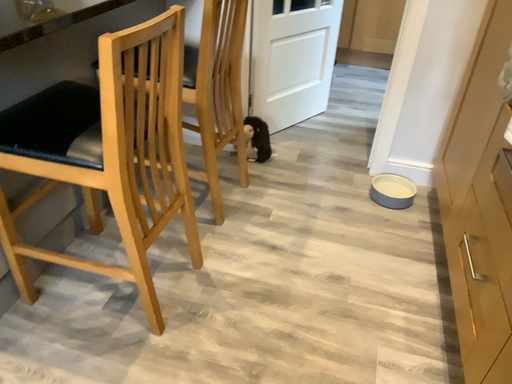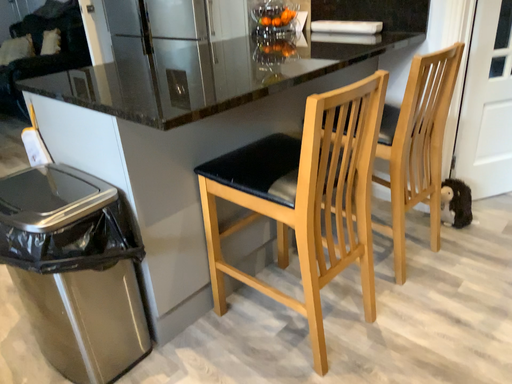
Question: How did the camera likely rotate when shooting the video?

Choices:
 (A) rotated left
 (B) rotated right

Answer: (A)